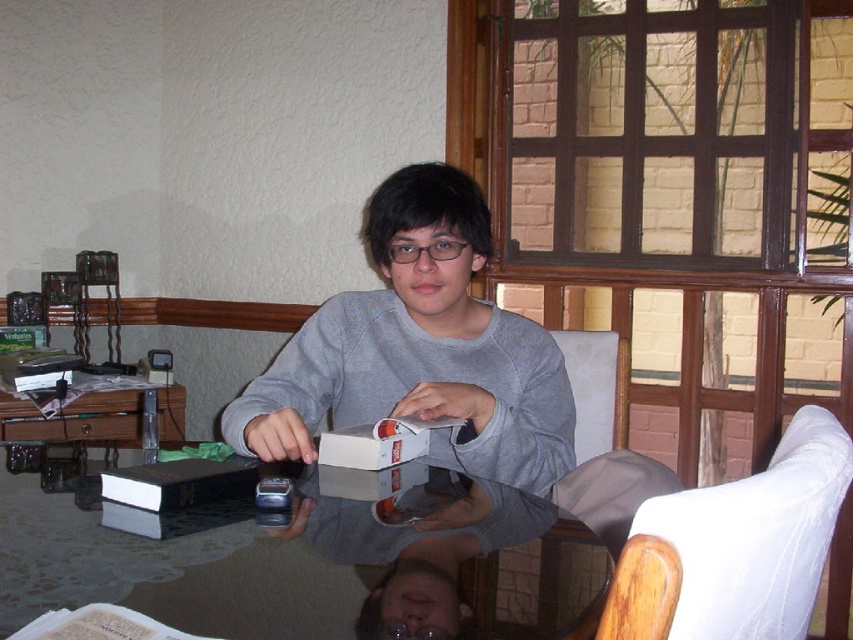
Question: Does gray matte shirt at center have a lesser width compared to wooden chair at lower right?

Choices:
 (A) yes
 (B) no

Answer: (B)

Question: Can you confirm if transparent glass table at center is positioned above black matte book at lower left?

Choices:
 (A) no
 (B) yes

Answer: (A)

Question: Does white fabric armchair at right come in front of black matte book at lower left?

Choices:
 (A) yes
 (B) no

Answer: (A)

Question: Which object is positioned farthest from the black matte book at lower left?

Choices:
 (A) white fabric armchair at right
 (B) white fabric armchair at center

Answer: (B)

Question: Which of the following is the closest to the observer?

Choices:
 (A) black matte book at lower left
 (B) wooden chair at lower right

Answer: (B)

Question: Which point appears farthest from the camera in this image?

Choices:
 (A) (785, 589)
 (B) (659, 556)
 (C) (265, 426)

Answer: (C)